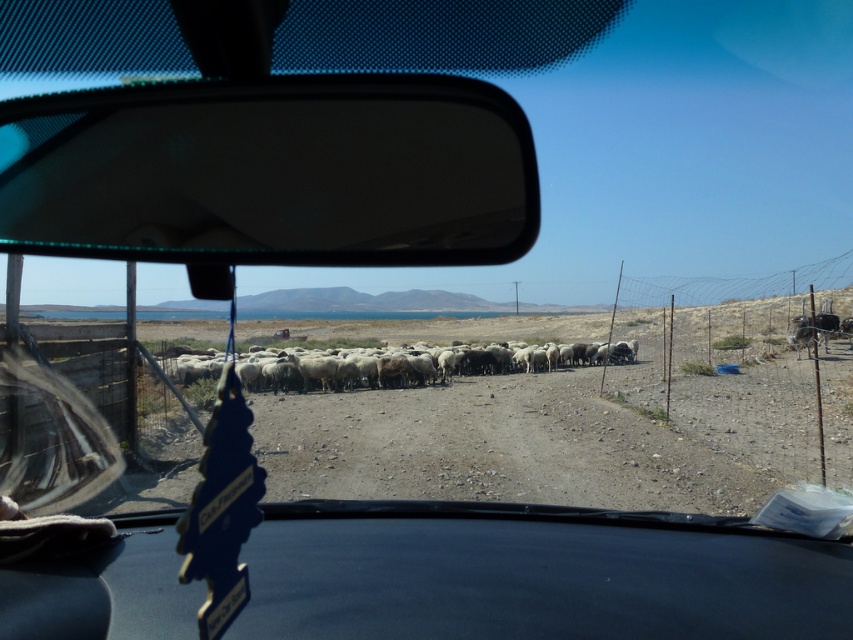
You are a passenger in the car and want to compare the height of the black leather dashboard at center and the white woolly sheep at center. Which one appears taller from your viewpoint inside the car?

The white woolly sheep at center appears taller than the black leather dashboard at center because the black leather dashboard at center has a lesser height compared to white woolly sheep at center.

You are a passenger in the car and want to look at the flock of sheep outside through the windshield. Which object in the car, the transparent plastic view mirror at upper center or the black leather dashboard at center, would block your view of the sheep if it is in the way?

The transparent plastic view mirror at upper center would block your view of the sheep because it is much taller than the black leather dashboard at center and is positioned in the upper part of the windshield, potentially obstructing the upper portion of the view.

You are a passenger in the car and want to check the rearview mirror to see if the sheep are still behind us. Which object should you look at, the transparent plastic view mirror at upper center or the black leather dashboard at center?

You should look at the transparent plastic view mirror at upper center because it is the rearview mirror used to view behind the vehicle, while the black leather dashboard at center is part of the car interior and does not provide a rear view.